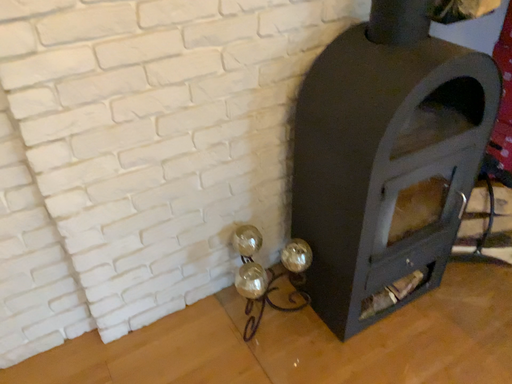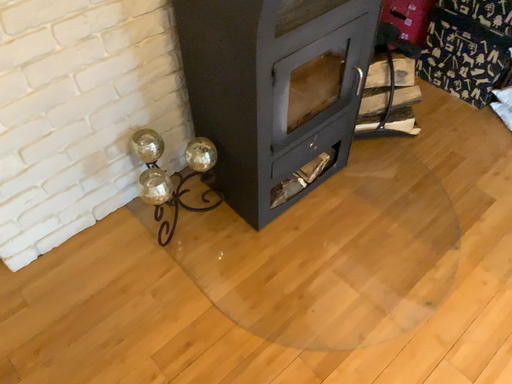
Question: Which way did the camera rotate in the video?

Choices:
 (A) rotated left
 (B) rotated right

Answer: (B)